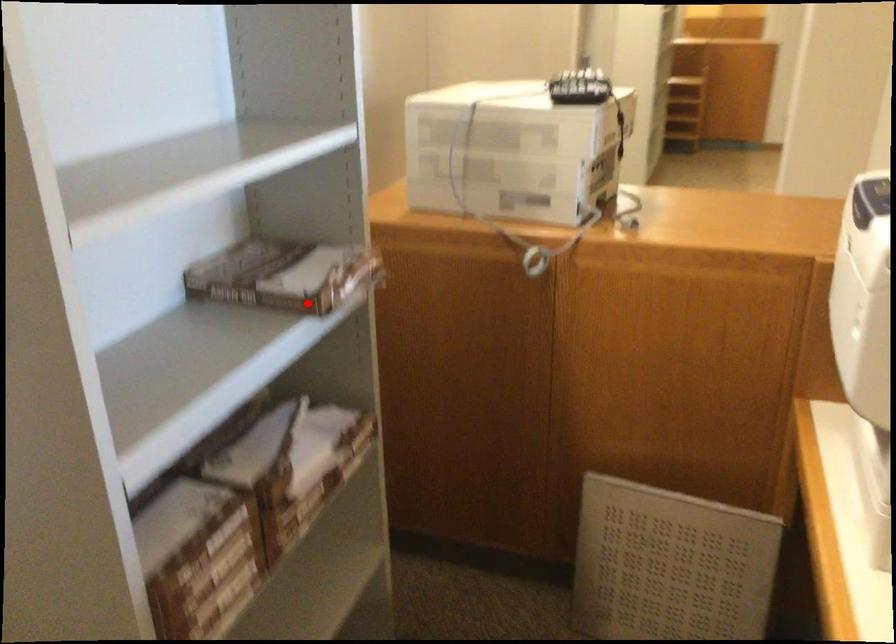
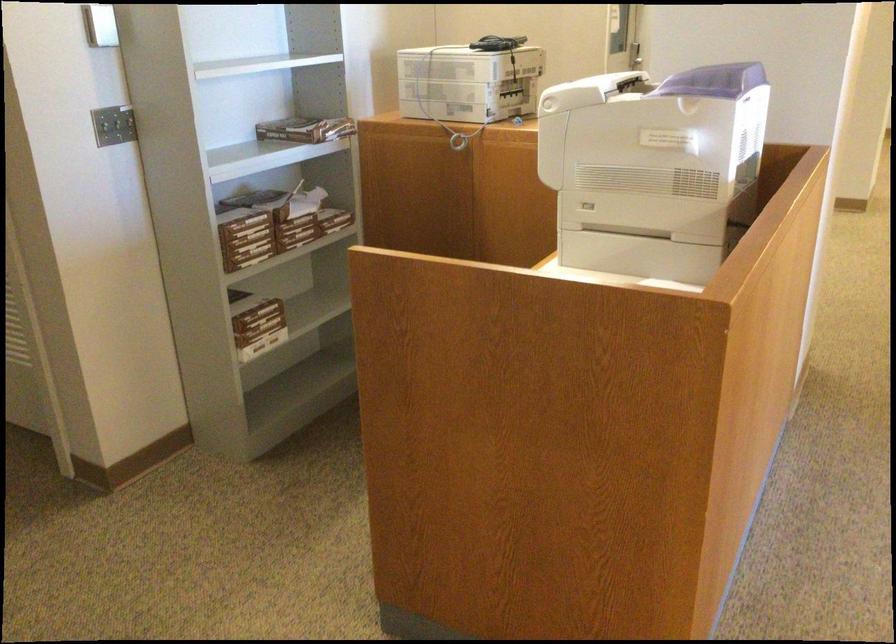
Question: A red point is marked in image1. In image2, is the corresponding 3D point closer to the camera or farther? Reply with the corresponding letter.

Choices:
 (A) The corresponding 3D point is closer.
 (B) The corresponding 3D point is farther.

Answer: (B)